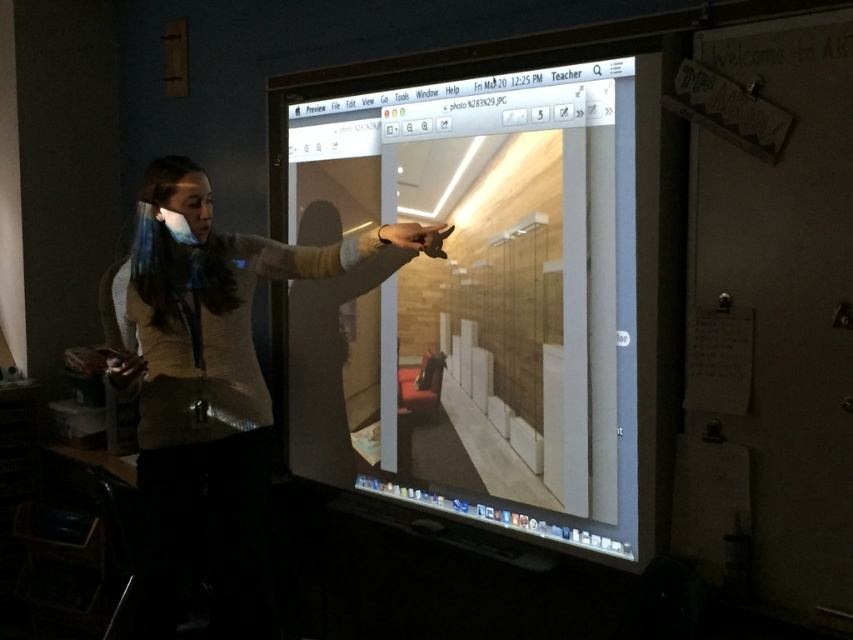
You are designing a layout for a magazine article and need to place a rectangular text box between the matte wooden screen at center and the matte beige sweater at center. Given their relative thickness, which object should the text box be closer to?

The text box should be closer to the matte wooden screen at center because it is thinner than the matte beige sweater at center, allowing for better spacing and balance in the layout.

You are attending a virtual meeting where the presenter is wearing a matte beige sweater at center and standing next to a matte wooden screen at center. From your perspective, which object is positioned to the right?

The matte wooden screen at center is to the right of the matte beige sweater at center.